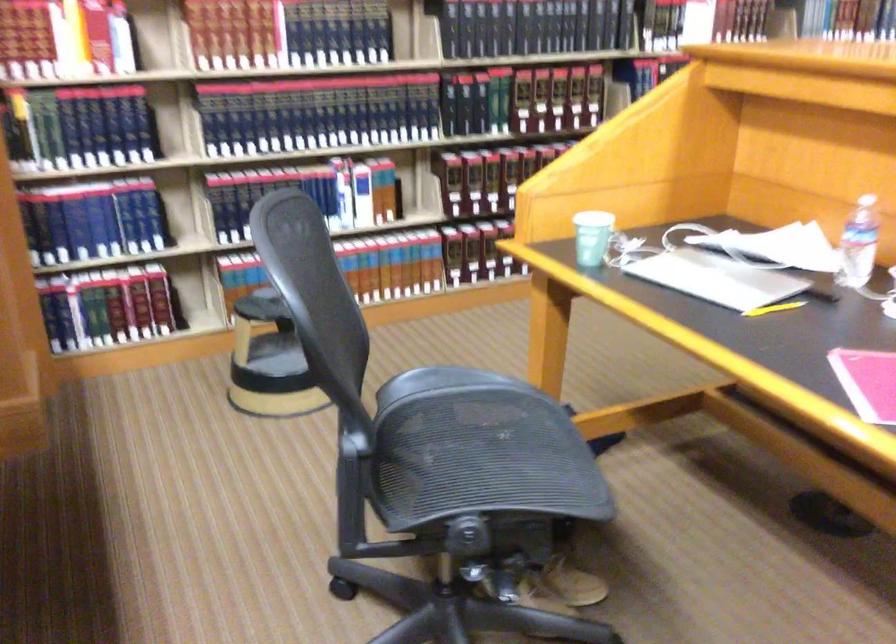
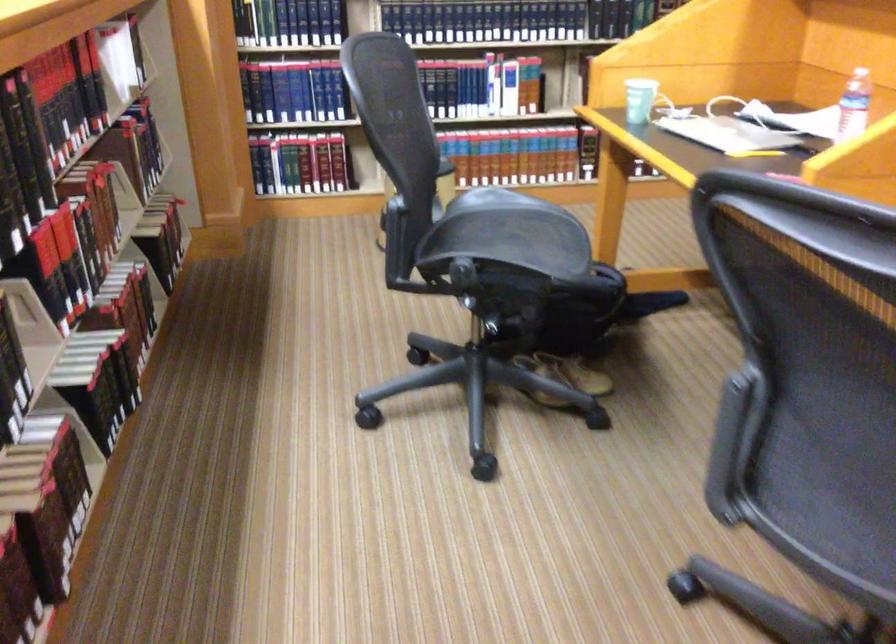
Question: I am providing you with two images of the same scene from different viewpoints. After the viewpoint changes to image2, which objects are now occluded?

Choices:
 (A) plastic water bottle
 (B) cabinet door cutout
 (C) hardcover book
 (D) paper cup

Answer: (C)